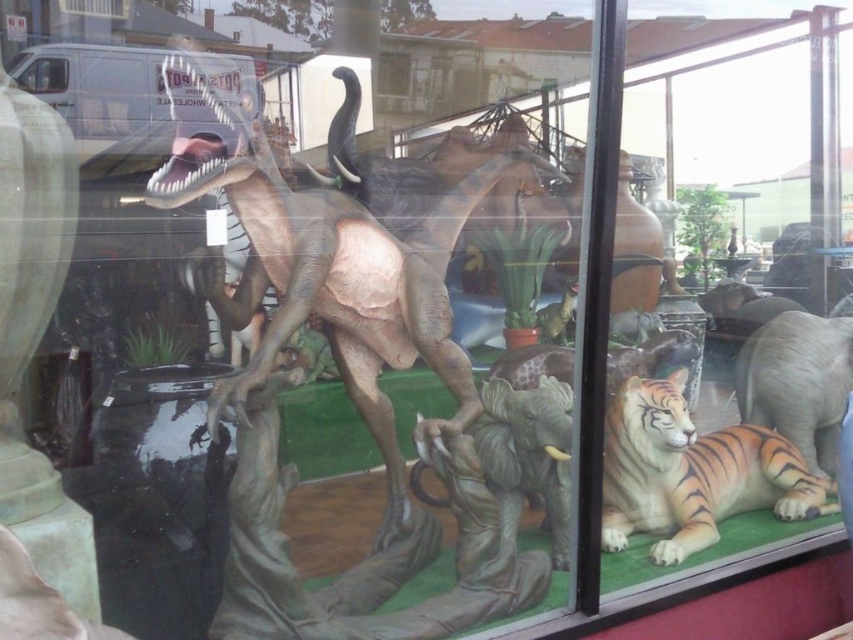
Between point (392, 417) and point (604, 456), which one is positioned behind?

Positioned behind is point (604, 456).

Is point (373, 225) in front of point (833, 499)?

Yes.

What do you see at coordinates (357, 266) in the screenshot?
I see `smooth gray dinosaur at center` at bounding box center [357, 266].

At what (x,y) coordinates should I click in order to perform the action: click on smooth gray dinosaur at center. Please return your answer as a coordinate pair (x, y). The image size is (853, 640). Looking at the image, I should click on (357, 266).